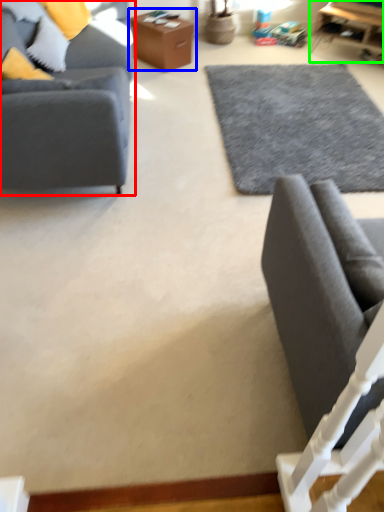
Question: Which is farther away from studio couch (highlighted by a red box)? table (highlighted by a blue box) or table (highlighted by a green box)?

Choices:
 (A) table
 (B) table

Answer: (B)